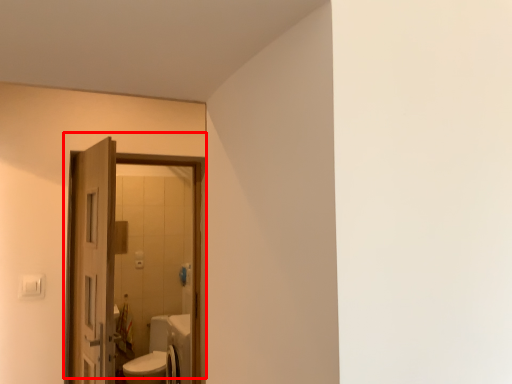
Question: Where is door (annotated by the red box) located in relation to door in the image?

Choices:
 (A) right
 (B) left

Answer: (A)